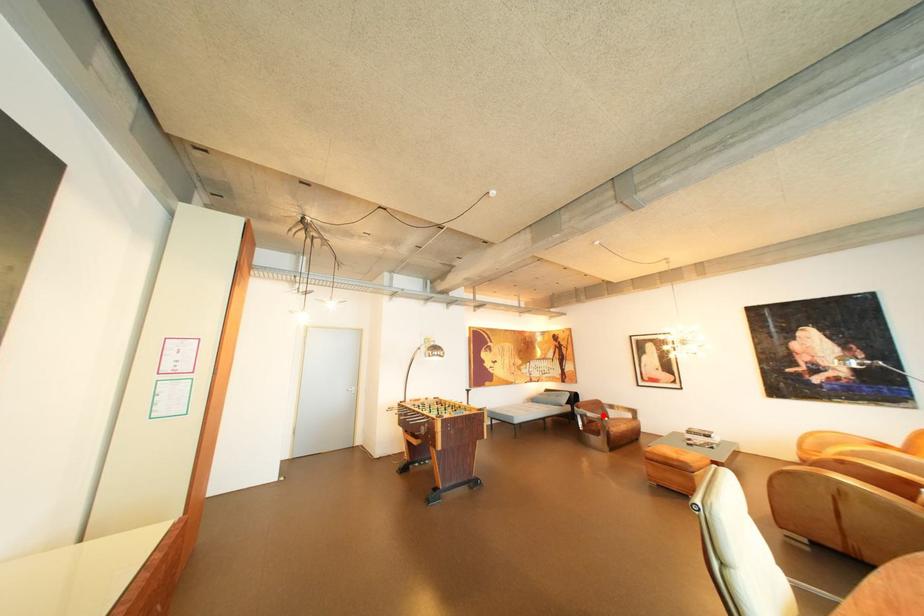
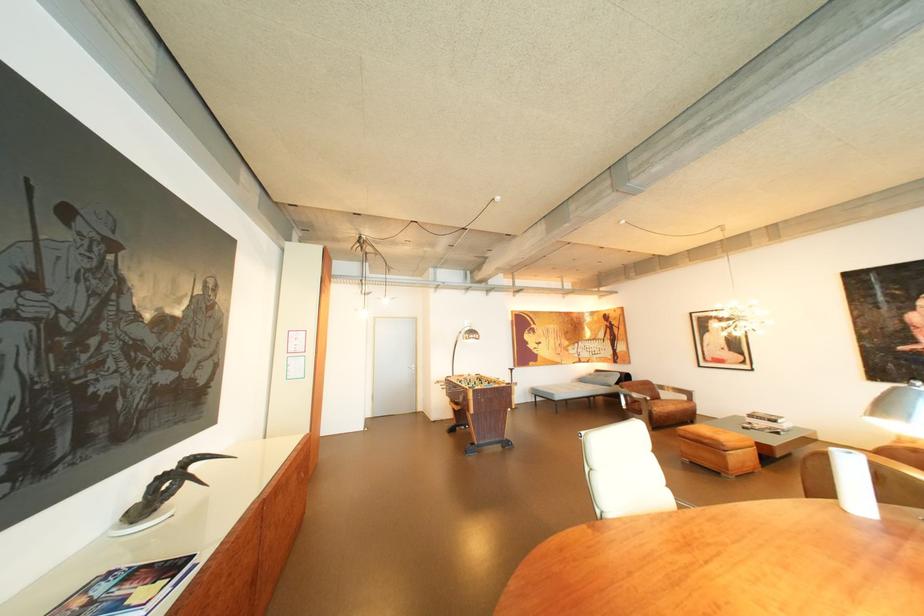
Where in the second image is the point corresponding to the highlighted location from the first image?

(649, 395)